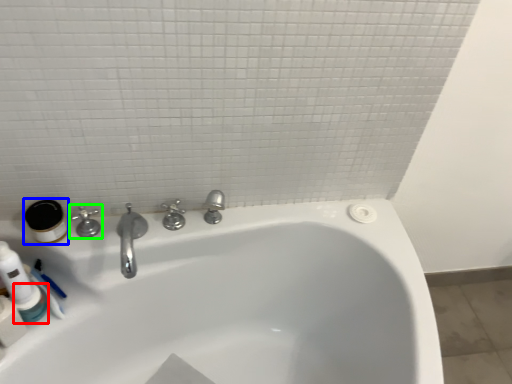
Question: Which object is positioned closest to mouthwash (highlighted by a red box)? Select from mouthwash (highlighted by a blue box) and tap (highlighted by a green box).

Choices:
 (A) mouthwash
 (B) tap

Answer: (A)